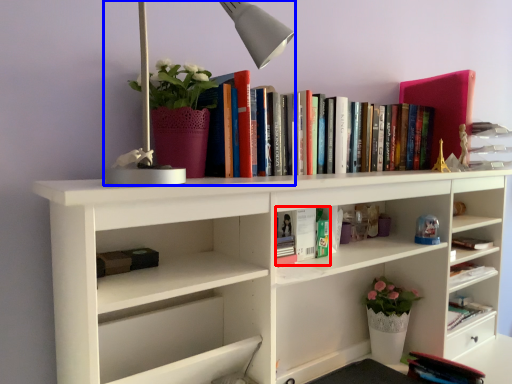
Question: Which object appears farthest to the camera in this image, book (highlighted by a red box) or table lamp (highlighted by a blue box)?

Choices:
 (A) book
 (B) table lamp

Answer: (A)